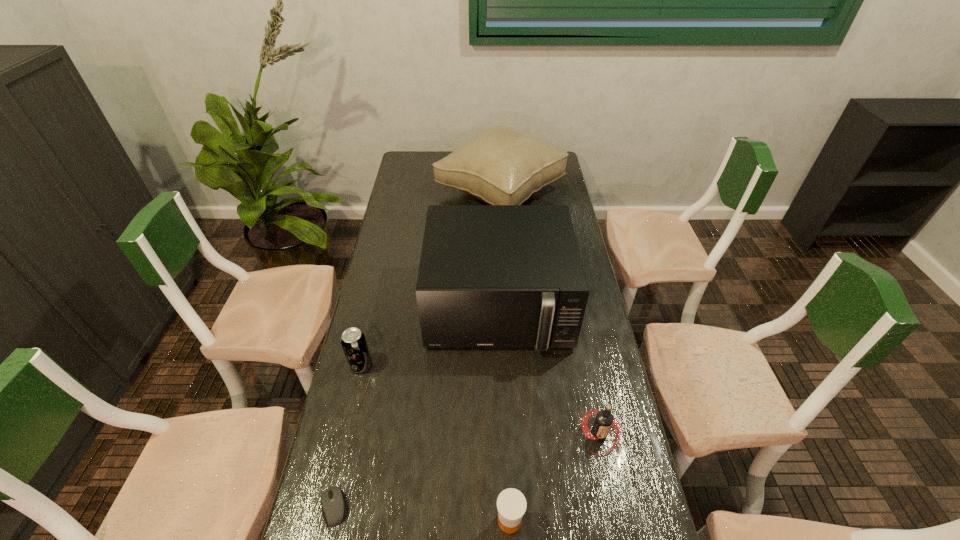
Locate an element on the screen. Image resolution: width=960 pixels, height=540 pixels. free spot located on the label of the medicine is located at coordinates pos(436,521).

Locate an element on the screen. The image size is (960, 540). free region located 0.320m on the label of the medicine is located at coordinates (360, 521).

The width and height of the screenshot is (960, 540). What are the coordinates of `blank area located on the label of the medicine` in the screenshot? It's located at (406, 521).

The image size is (960, 540). I want to click on vacant area located on the back of the computer equipment, so click(x=349, y=437).

Image resolution: width=960 pixels, height=540 pixels. What are the coordinates of `object that is at the far edge` in the screenshot? It's located at (501, 165).

Where is `soda can situated at the left edge`? soda can situated at the left edge is located at coordinates (353, 341).

I want to click on computer equipment positioned at the left edge, so click(x=332, y=500).

At what (x,y) coordinates should I click in order to perform the action: click on cushion that is at the right edge. Please return your answer as a coordinate pair (x, y). Image resolution: width=960 pixels, height=540 pixels. Looking at the image, I should click on (501, 165).

You are a GUI agent. You are given a task and a screenshot of the screen. Output one action in this format:
    pyautogui.click(x=<x>, y=<y>)
    Task: Click on the microwave oven present at the right edge
    This screenshot has height=540, width=960.
    Given the screenshot: What is the action you would take?
    pyautogui.click(x=490, y=276)

In order to click on root beer at the right edge in this screenshot , I will do `click(604, 419)`.